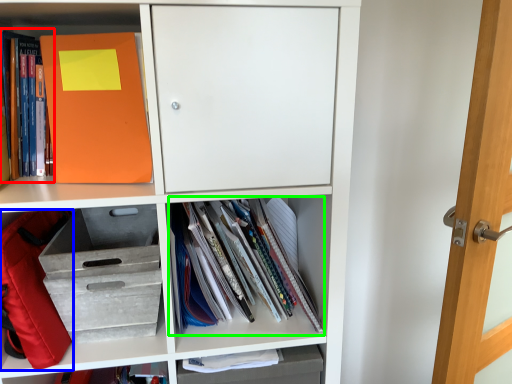
Question: Which object is the closest to the book (highlighted by a red box)? Choose among these: backpack (highlighted by a blue box) or book (highlighted by a green box).

Choices:
 (A) backpack
 (B) book

Answer: (A)